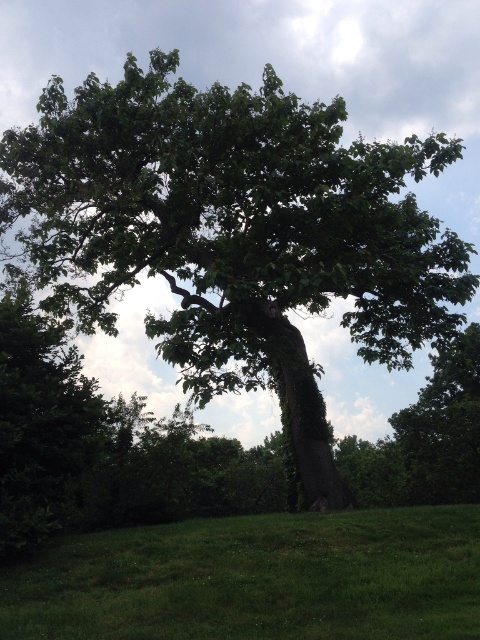
You are standing on the green grass at lower center and want to reach the green leafy oak tree at center. In which direction should you walk?

You should walk to the left because the green leafy oak tree at center is to the right of green grass at lower center.

You are standing at the origin point in the image. The green leafy oak tree at center is at coordinates 0.367, 0.494. If you want to walk directly towards it, which direction should you head?

The green leafy oak tree at center is located at point (237, 234), so you should head in the direction of those coordinates to reach it.